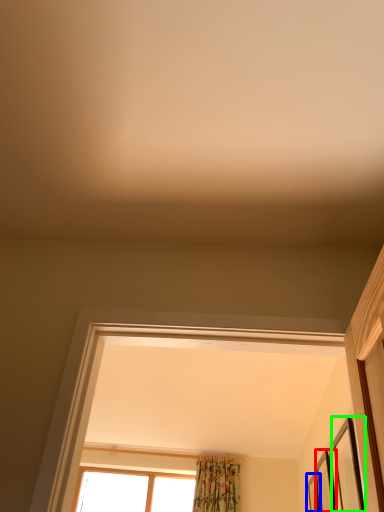
Question: Which object is positioned farthest from picture frame (highlighted by a red box)? Select from picture frame (highlighted by a blue box) and picture frame (highlighted by a green box).

Choices:
 (A) picture frame
 (B) picture frame

Answer: (B)